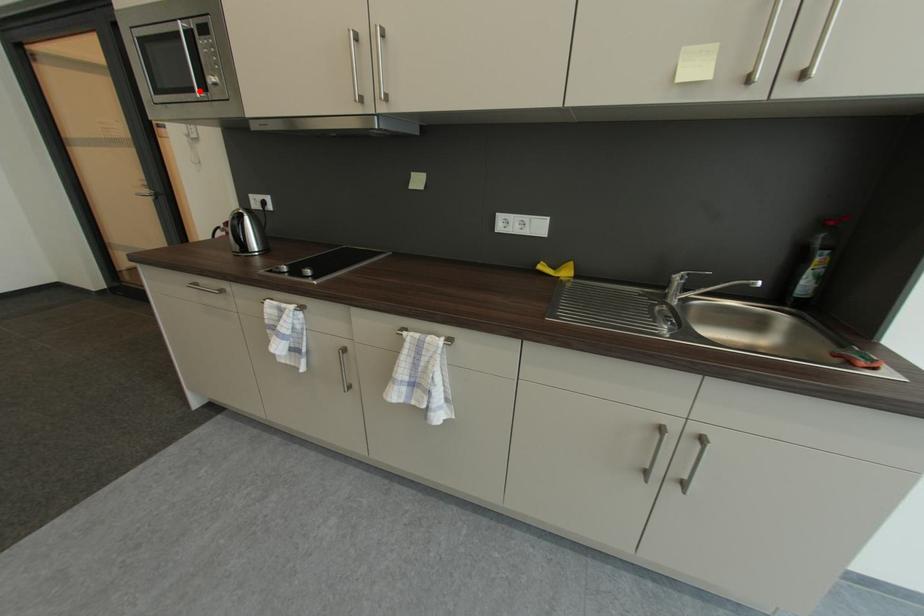
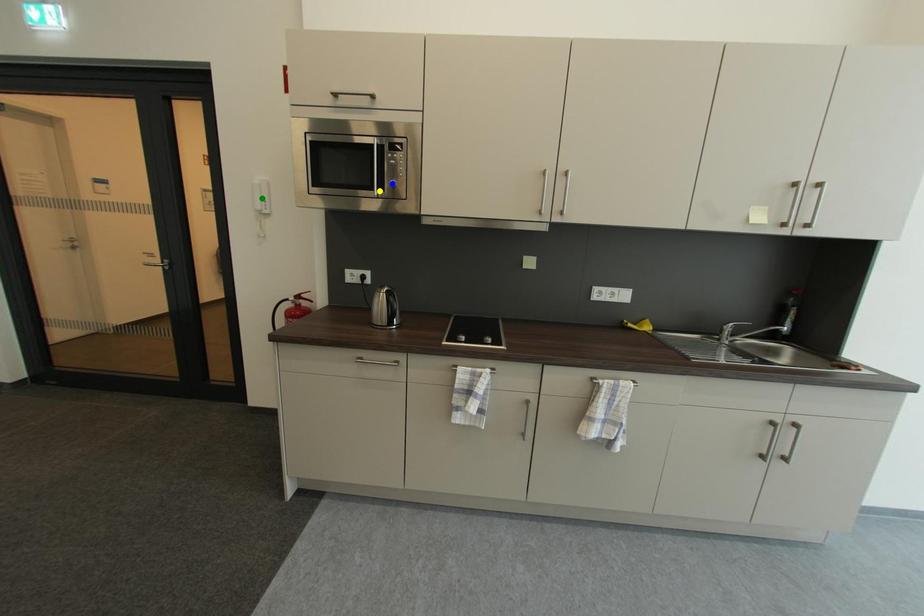
Question: I am providing you with two images of the same scene from different viewpoints. A red point is marked on the first image. You are given multiple points on the second image. Which point in image 2 is actually the same real-world point as the red point in image 1?

Choices:
 (A) yellow point
 (B) green point
 (C) blue point

Answer: (A)